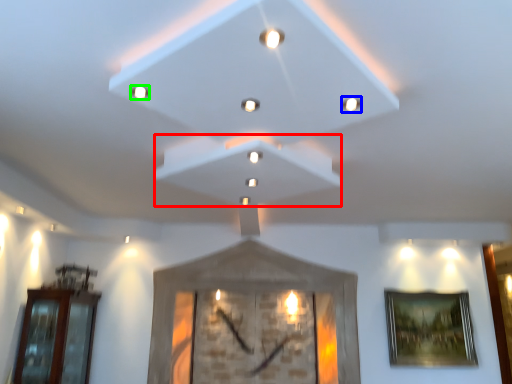
Question: Based on their relative distances, which object is nearer to exhaust hood (highlighted by a red box)? Choose from light (highlighted by a blue box) and light (highlighted by a green box).

Choices:
 (A) light
 (B) light

Answer: (A)